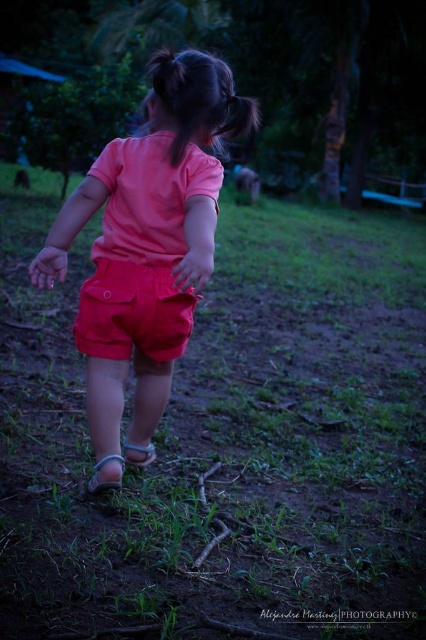
Question: Can you confirm if green grass at center is positioned above coral fabric shorts at center?

Choices:
 (A) no
 (B) yes

Answer: (B)

Question: Which point is farther to the camera?

Choices:
 (A) (101, 332)
 (B) (51, 403)

Answer: (B)

Question: Which of the following is the closest to the observer?

Choices:
 (A) (118, 225)
 (B) (417, 298)

Answer: (A)

Question: Is coral fabric shorts at center smaller than matte cotton shorts at center?

Choices:
 (A) no
 (B) yes

Answer: (A)

Question: Among these points, which one is nearest to the camera?

Choices:
 (A) (183, 198)
 (B) (140, 275)

Answer: (A)

Question: Does green grass at center have a greater width compared to black silky hair at upper center?

Choices:
 (A) no
 (B) yes

Answer: (B)